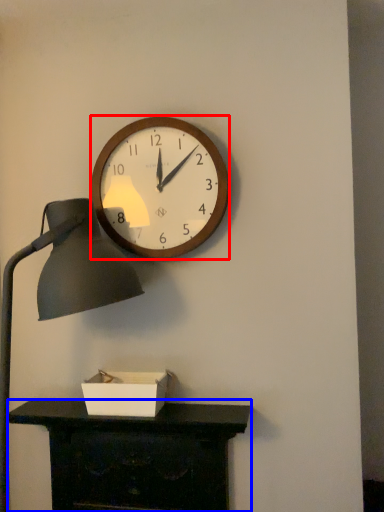
Question: Which object is closer to the camera taking this photo, wall clock (highlighted by a red box) or desk (highlighted by a blue box)?

Choices:
 (A) wall clock
 (B) desk

Answer: (B)